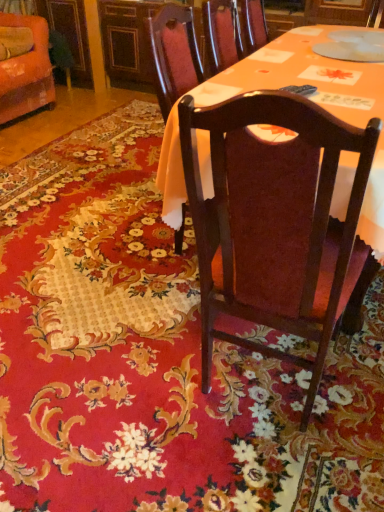
You are a GUI agent. You are given a task and a screenshot of the screen. Output one action in this format:
    pyautogui.click(x=<x>, y=<y>)
    Task: Click on the vacant space situated on the left part of matte wood table at center
    The image size is (384, 512).
    Given the screenshot: What is the action you would take?
    pyautogui.click(x=123, y=255)